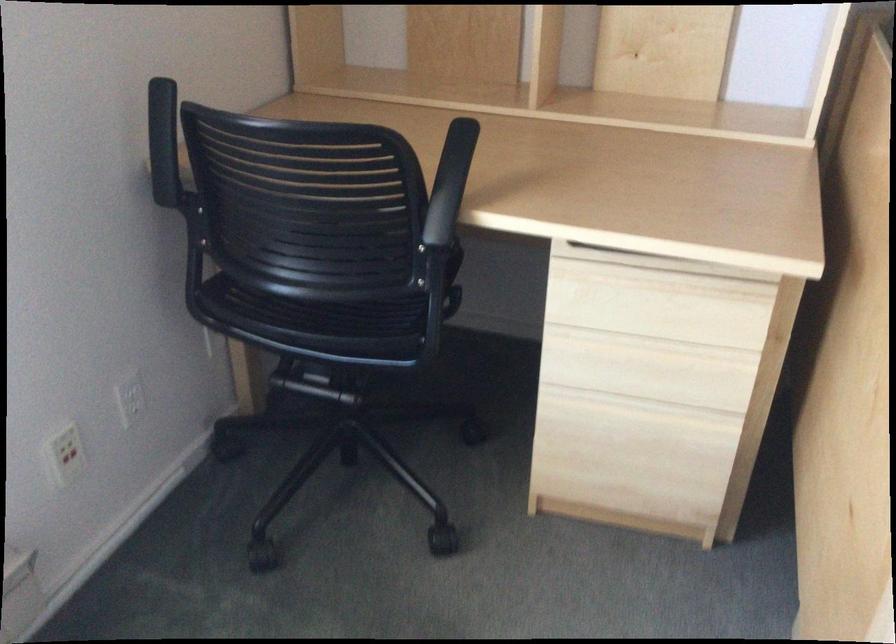
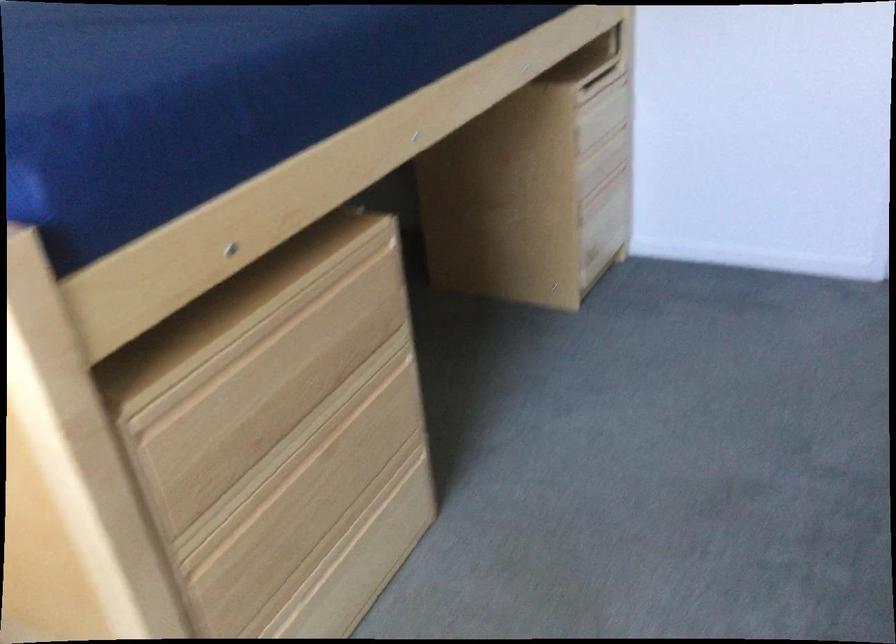
How did the camera likely rotate?

The camera rotated toward right-down.